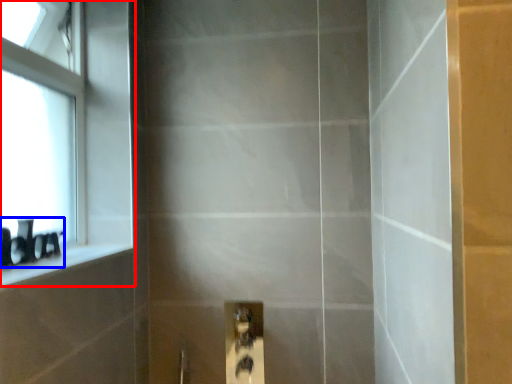
Question: Which point is closer to the camera, window (highlighted by a red box) or toiletry (highlighted by a blue box)?

Choices:
 (A) window
 (B) toiletry

Answer: (B)